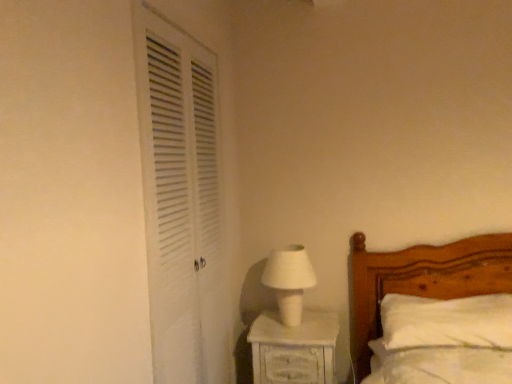
Question: From the image's perspective, is white soft pillow at lower right located above or below white painted wood nightstand at lower right?

Choices:
 (A) below
 (B) above

Answer: (B)

Question: Does point (382, 304) appear closer or farther from the camera than point (331, 370)?

Choices:
 (A) farther
 (B) closer

Answer: (A)

Question: Based on their relative distances, which object is nearer to the white matte table lamp at center?

Choices:
 (A) white louvered door at left
 (B) white painted wood nightstand at lower right
 (C) white soft pillow at lower right

Answer: (B)

Question: Which object is positioned closest to the white louvered door at left?

Choices:
 (A) white painted wood nightstand at lower right
 (B) white matte table lamp at center
 (C) white soft pillow at lower right

Answer: (B)